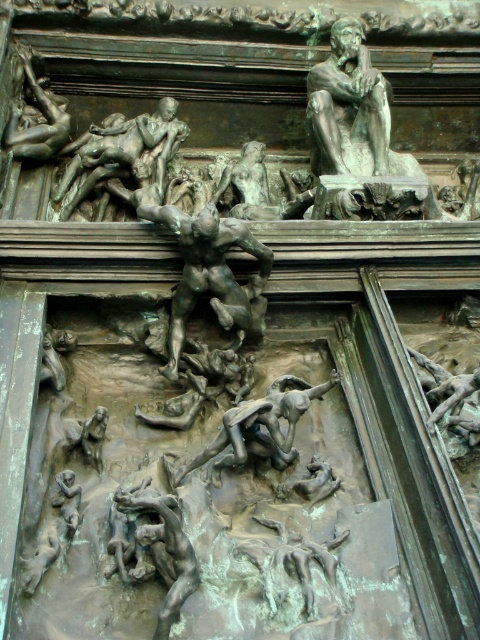
Between point (88, 132) and point (280, 392), which one is positioned in front?

Positioned in front is point (280, 392).

Is point (163, 108) positioned behind point (303, 394)?

Yes, point (163, 108) is farther from viewer.

The width and height of the screenshot is (480, 640). Identify the location of bronze textured figures at upper left. (122, 154).

Where is `bronze textured figures at upper left`? bronze textured figures at upper left is located at coordinates (122, 154).

Which is below, bronze muscular figure at center or bronze textured figure at center?

Positioned lower is bronze textured figure at center.

Does point (170, 355) lie behind point (283, 464)?

Yes, it is behind point (283, 464).

Identify the location of bronze muscular figure at center. [208, 269].

Who is positioned more to the left, bronze textured figures at upper left or bronze textured figure at lower left?

From the viewer's perspective, bronze textured figures at upper left appears more on the left side.

Does bronze textured figures at upper left appear under bronze textured figure at lower left?

Actually, bronze textured figures at upper left is above bronze textured figure at lower left.

What do you see at coordinates (122, 154) in the screenshot? I see `bronze textured figures at upper left` at bounding box center [122, 154].

Locate an element on the screen. bronze textured figures at upper left is located at coordinates (122, 154).